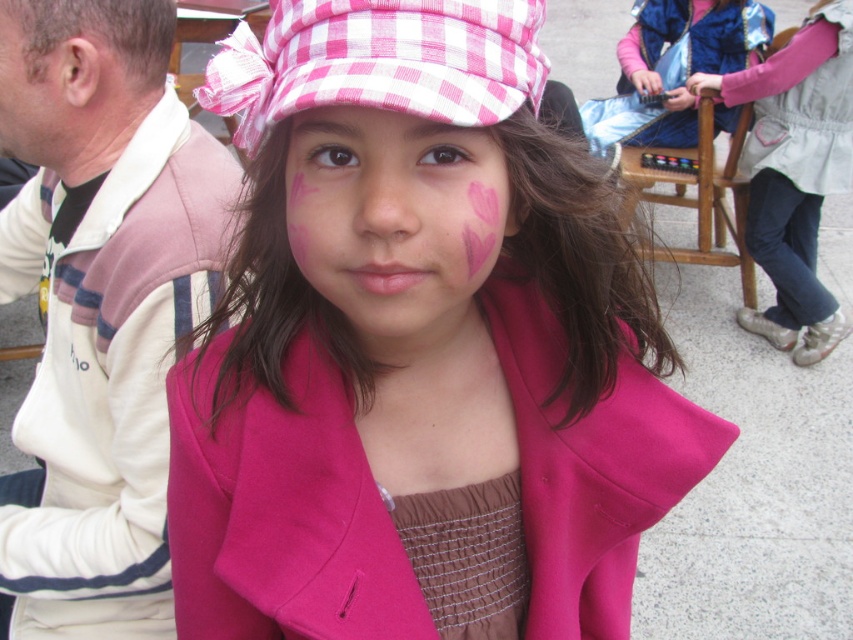
Can you confirm if pink matte jacket at center is positioned to the right of pink fabric jacket at upper right?

No, pink matte jacket at center is not to the right of pink fabric jacket at upper right.

Who is positioned more to the right, pink matte jacket at center or pink fabric jacket at upper right?

pink fabric jacket at upper right is more to the right.

This screenshot has width=853, height=640. I want to click on pink matte jacket at center, so click(x=109, y=376).

Is brown mesh dress at center above pink fabric jacket at upper right?

Incorrect, brown mesh dress at center is not positioned above pink fabric jacket at upper right.

Is brown mesh dress at center positioned behind pink fabric jacket at upper right?

That is False.

Is point (440, 548) less distant than point (820, 152)?

Yes, point (440, 548) is in front of point (820, 152).

At what (x,y) coordinates should I click in order to perform the action: click on brown mesh dress at center. Please return your answer as a coordinate pair (x, y). This screenshot has height=640, width=853. Looking at the image, I should click on (468, 556).

Who is positioned more to the right, pink matte hat at upper center or dry skin at left?

Positioned to the right is pink matte hat at upper center.

Does pink matte hat at upper center have a greater width compared to dry skin at left?

Correct, the width of pink matte hat at upper center exceeds that of dry skin at left.

The width and height of the screenshot is (853, 640). Describe the element at coordinates (415, 340) in the screenshot. I see `pink matte hat at upper center` at that location.

Identify the location of pink matte hat at upper center. The width and height of the screenshot is (853, 640). (415, 340).